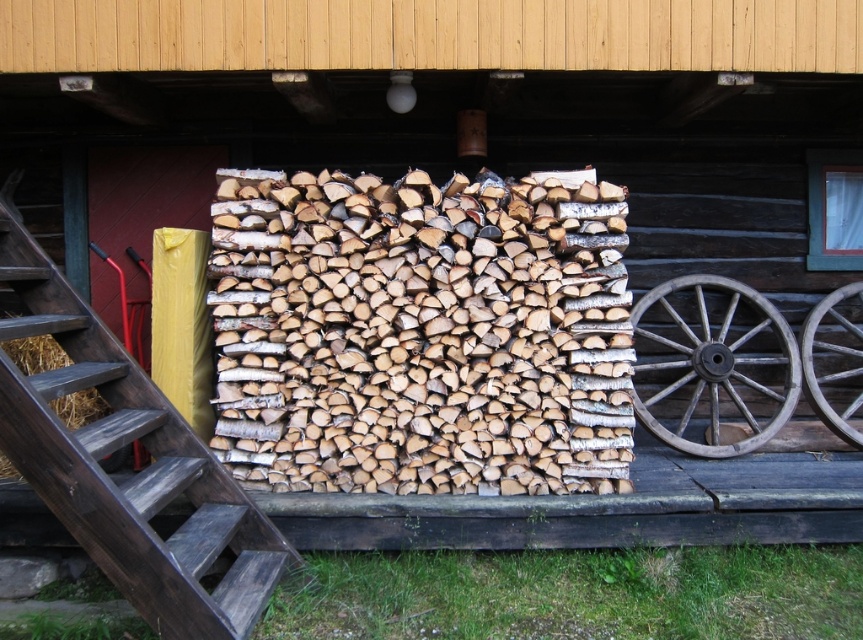
Between wooden stairs at left and wooden at right, which one is positioned lower?

wooden stairs at left is below.

Does point (73, 509) lie behind point (799, 344)?

No, (73, 509) is closer to viewer.

I want to click on wooden stairs at left, so click(133, 474).

Between dark brown wooden wagon wheel at right and wooden at right, which one is positioned higher?

Positioned higher is dark brown wooden wagon wheel at right.

Does point (672, 419) come closer to viewer compared to point (826, 378)?

No, (672, 419) is further to viewer.

Does point (662, 305) come closer to viewer compared to point (849, 435)?

That is False.

Where is `dark brown wooden wagon wheel at right`? This screenshot has height=640, width=863. dark brown wooden wagon wheel at right is located at coordinates (712, 365).

Between point (255, 609) and point (732, 404), which one is positioned in front?

Point (255, 609) is more forward.

Based on the photo, measure the distance between wooden stairs at left and camera.

3.00 meters

Does point (171, 608) come behind point (691, 317)?

That is False.

At what (x,y) coordinates should I click in order to perform the action: click on wooden stairs at left. Please return your answer as a coordinate pair (x, y). The width and height of the screenshot is (863, 640). Looking at the image, I should click on (133, 474).